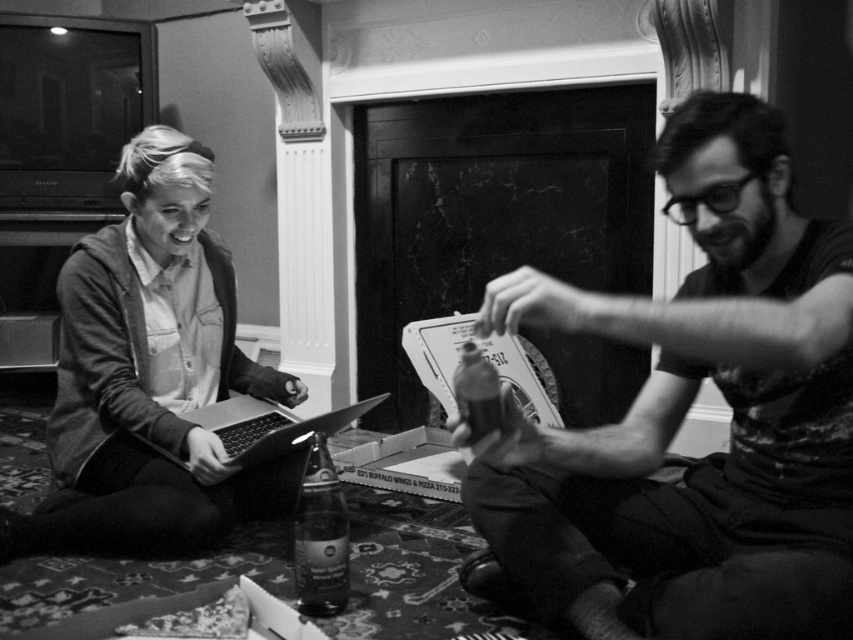
Question: Which is farther from the metallic silver laptop at center?

Choices:
 (A) translucent glass bottle at center
 (B) clear glass bottle at center

Answer: (A)

Question: Where is metallic silver laptop at center located in relation to translucent glass bottle at center in the image?

Choices:
 (A) above
 (B) below

Answer: (B)

Question: Is matte black shirt at center closer to the viewer compared to denim jacket at left?

Choices:
 (A) yes
 (B) no

Answer: (A)

Question: Based on their relative distances, which object is farther from the denim jacket at left?

Choices:
 (A) translucent glass bottle at center
 (B) metallic silver laptop at center
 (C) clear glass bottle at center

Answer: (A)

Question: Can you confirm if clear glass bottle at center is bigger than translucent glass bottle at center?

Choices:
 (A) no
 (B) yes

Answer: (B)

Question: Which object is closer to the camera taking this photo?

Choices:
 (A) metallic silver laptop at center
 (B) matte black shirt at center
 (C) translucent glass bottle at center

Answer: (B)